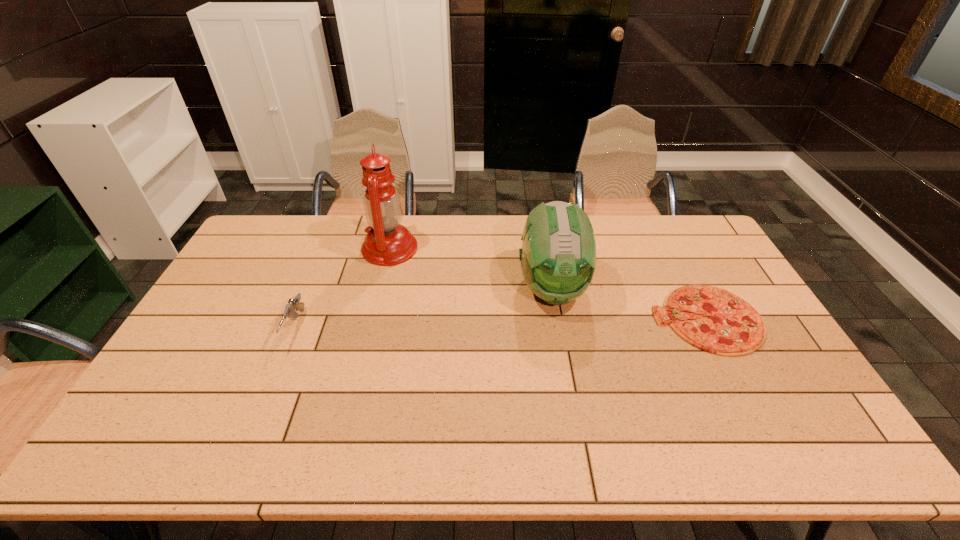
Locate an element on the screen. oil lamp is located at coordinates (387, 243).

This screenshot has height=540, width=960. Identify the location of the second object from left to right. (387, 243).

Find the location of a particular element. Image resolution: width=960 pixels, height=540 pixels. football helmet is located at coordinates (558, 256).

Identify the location of the farthest object. (570, 202).

You are a GUI agent. You are given a task and a screenshot of the screen. Output one action in this format:
    pyautogui.click(x=<x>, y=<y>)
    Task: Click on the padlock
    
    Given the screenshot: What is the action you would take?
    pyautogui.click(x=570, y=202)

Find the location of a particular element. This screenshot has width=960, height=540. the leftmost object is located at coordinates (294, 303).

The width and height of the screenshot is (960, 540). In order to click on gun in this screenshot , I will do `click(294, 303)`.

The width and height of the screenshot is (960, 540). In order to click on pizza in this screenshot , I will do `click(730, 326)`.

Where is `the shortest object`? The width and height of the screenshot is (960, 540). the shortest object is located at coordinates (730, 326).

You are a GUI agent. You are given a task and a screenshot of the screen. Output one action in this format:
    pyautogui.click(x=<x>, y=<y>)
    Task: Click on the free location located on the left of the second object from left to right
    
    Given the screenshot: What is the action you would take?
    pyautogui.click(x=296, y=248)